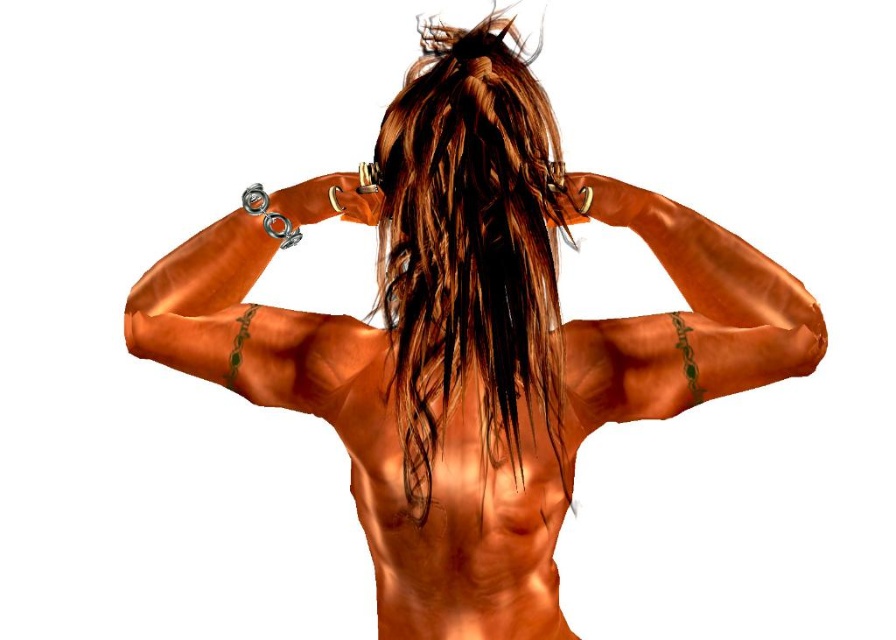
Question: Based on their relative distances, which object is nearer to the shiny metallic bicep at center?

Choices:
 (A) satin-like skin at upper right
 (B) brown shiny hair at center

Answer: (B)

Question: Can you confirm if satin-like skin at upper right is positioned below shiny metallic bicep at center?

Choices:
 (A) yes
 (B) no

Answer: (A)

Question: Does brown shiny hair at center have a larger size compared to satin-like skin at upper right?

Choices:
 (A) yes
 (B) no

Answer: (A)

Question: Which point is closer to the camera?

Choices:
 (A) brown shiny hair at center
 (B) shiny metallic bicep at center

Answer: (A)

Question: Does brown shiny hair at center appear over satin-like skin at upper right?

Choices:
 (A) yes
 (B) no

Answer: (A)

Question: Which object appears farthest from the camera in this image?

Choices:
 (A) satin-like skin at upper right
 (B) shiny metallic bicep at center
 (C) brown shiny hair at center

Answer: (B)